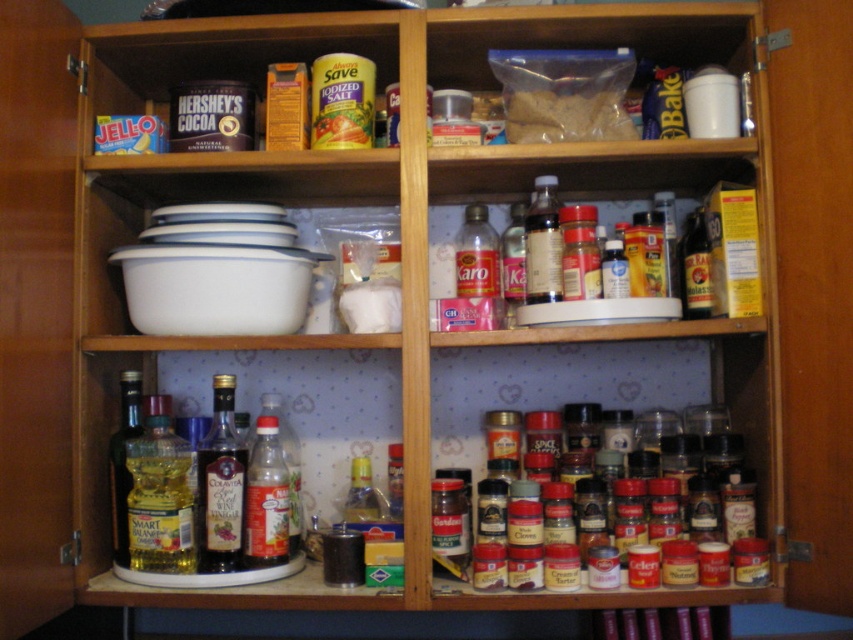
Does translucent plastic bottle at lower left come behind translucent plastic karo syrup at center?

No, it is not.

This screenshot has width=853, height=640. Identify the location of translucent plastic bottle at lower left. (265, 499).

Is translucent plastic bottle at lower left taller than translucent plastic bottle at lower center?

Indeed, translucent plastic bottle at lower left has a greater height compared to translucent plastic bottle at lower center.

Can you confirm if translucent plastic bottle at lower left is shorter than translucent plastic bottle at lower center?

Incorrect, translucent plastic bottle at lower left's height does not fall short of translucent plastic bottle at lower center's.

Which is in front, point (283, 541) or point (393, 452)?

Positioned in front is point (283, 541).

Where is `translucent plastic bottle at lower left`? The image size is (853, 640). translucent plastic bottle at lower left is located at coordinates (265, 499).

Based on the photo, is clear glass bottle at center to the left of translucent plastic bottle at lower center from the viewer's perspective?

Indeed, clear glass bottle at center is positioned on the left side of translucent plastic bottle at lower center.

Can you confirm if clear glass bottle at center is thinner than translucent plastic bottle at lower center?

No, clear glass bottle at center is not thinner than translucent plastic bottle at lower center.

Measure the distance between clear glass bottle at center and camera.

4.21 feet

Identify the location of clear glass bottle at center. (363, 496).